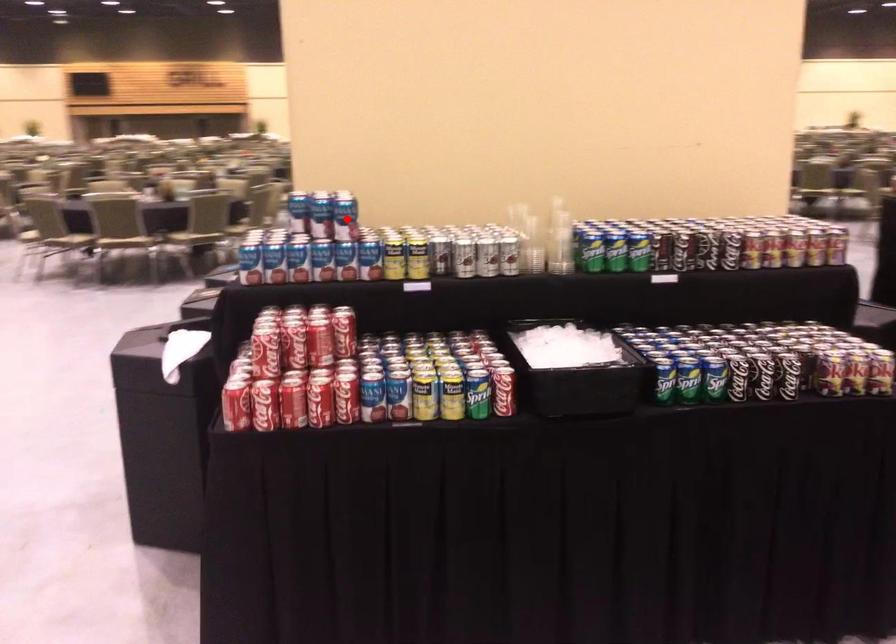
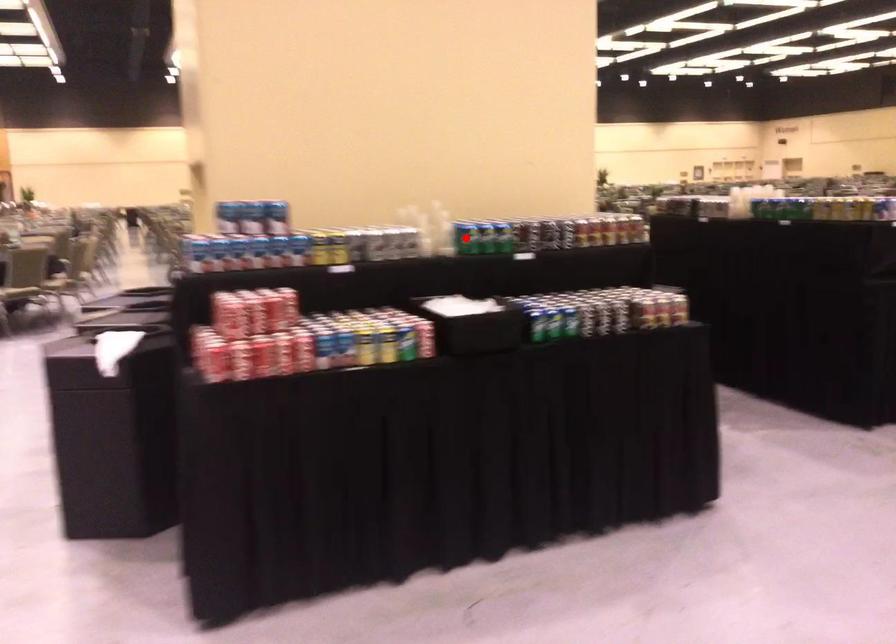
I am providing you with two images of the same scene from different viewpoints. A red point is marked on the first image and another point is marked on the second image. Is the red point in image1 aligned with the point shown in image2?

No